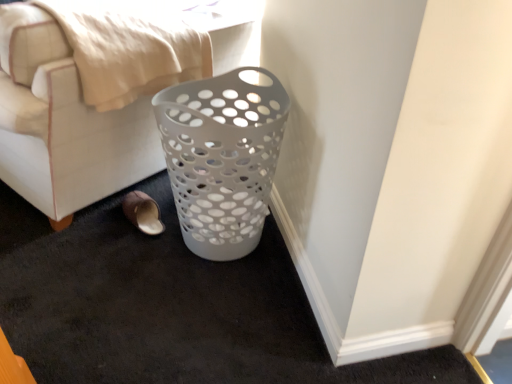
Question: In the image, is white plastic laundry basket at lower center positioned in front of or behind white plastic basket at lower right?

Choices:
 (A) behind
 (B) front

Answer: (B)

Question: Is white plastic laundry basket at lower center taller or shorter than white plastic basket at lower right?

Choices:
 (A) short
 (B) tall

Answer: (B)

Question: Based on their relative distances, which object is farther from the white plastic basket at lower right?

Choices:
 (A) brown suede slipper at lower left
 (B) white plastic laundry basket at lower center

Answer: (A)

Question: Which of these objects is positioned closest to the white plastic laundry basket at lower center?

Choices:
 (A) white plastic basket at lower right
 (B) brown suede slipper at lower left

Answer: (B)